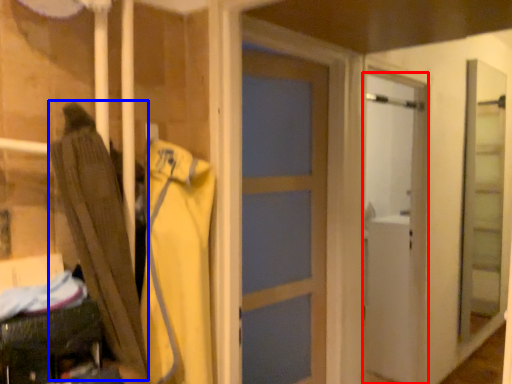
Question: Which object is further to the camera taking this photo, door (highlighted by a red box) or umbrella (highlighted by a blue box)?

Choices:
 (A) door
 (B) umbrella

Answer: (A)